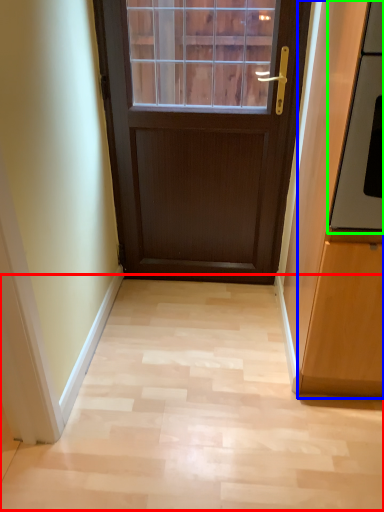
Question: Estimate the real-world distances between objects in this image. Which object is closer to corridor (highlighted by a red box), cabinetry (highlighted by a blue box) or oven (highlighted by a green box)?

Choices:
 (A) cabinetry
 (B) oven

Answer: (A)